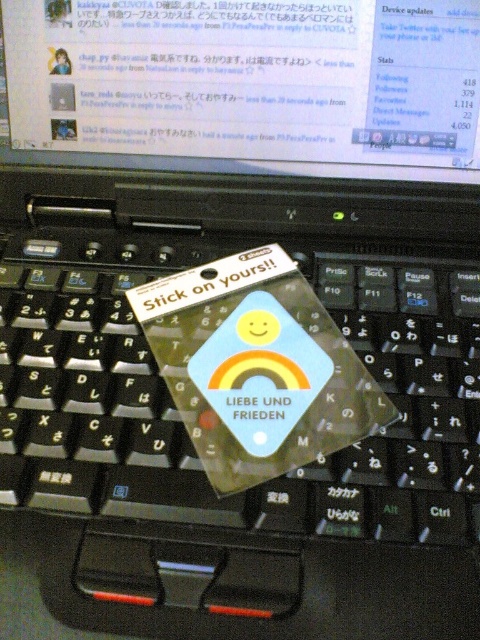
You are setting up a new laptop and want to ensure proper positioning. The matte plastic computer screen at upper center and the matte plastic sticker at center are both in your view. Which object is positioned higher on the screen?

The matte plastic computer screen at upper center is located above the matte plastic sticker at center, so it is positioned higher on the screen.

You are a graphic designer who needs to position a new sticker on the laptop keyboard. The sticker must be placed exactly where the matte plastic computer screen at upper center is located. What are the coordinates where you should place the sticker?

The coordinates for the matte plastic computer screen at upper center are at point (249, 84), so you should place the sticker there.

You are setting up a new laptop and need to place a mouse. The mouse requires a flat surface to the right of the black plastic keyboard at center. Is there enough space next to the matte plastic computer screen at upper center for the mouse?

The black plastic keyboard at center is to the left of matte plastic computer screen at upper center, so placing the mouse to the right of the keyboard would be near the screen. However, the description does not provide information about the available space next to the screen, so it cannot be determined if there is enough room for the mouse.